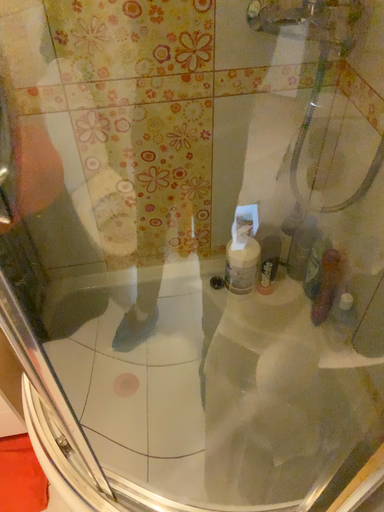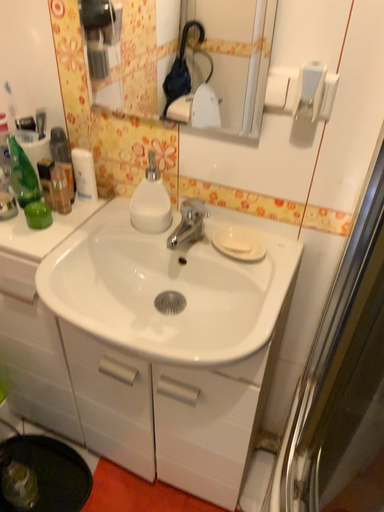
Question: How did the camera likely rotate when shooting the video?

Choices:
 (A) rotated downward
 (B) rotated upward

Answer: (B)